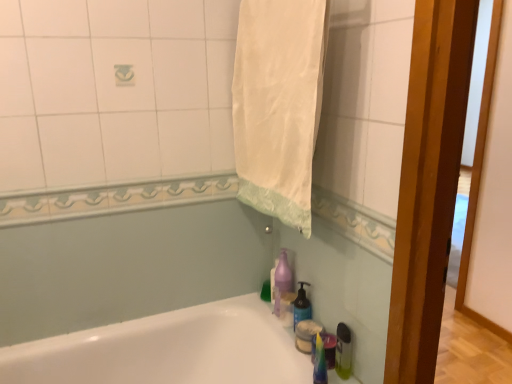
Question: Does white fabric towel at upper center have a lesser width compared to purple translucent soap dispenser at lower center?

Choices:
 (A) no
 (B) yes

Answer: (A)

Question: Is white fabric towel at upper center wider than purple translucent soap dispenser at lower center?

Choices:
 (A) yes
 (B) no

Answer: (A)

Question: Considering the relative sizes of white fabric towel at upper center and purple translucent soap dispenser at lower center in the image provided, is white fabric towel at upper center bigger than purple translucent soap dispenser at lower center?

Choices:
 (A) yes
 (B) no

Answer: (A)

Question: From the image's perspective, is white fabric towel at upper center on purple translucent soap dispenser at lower center?

Choices:
 (A) yes
 (B) no

Answer: (A)

Question: Is white fabric towel at upper center behind purple translucent soap dispenser at lower center?

Choices:
 (A) yes
 (B) no

Answer: (B)

Question: Relative to translucent plastic soap dispenser at lower right, is white fabric towel at upper center in front or behind?

Choices:
 (A) front
 (B) behind

Answer: (A)

Question: Looking at their shapes, would you say white fabric towel at upper center is wider or thinner than translucent plastic soap dispenser at lower right?

Choices:
 (A) wide
 (B) thin

Answer: (A)

Question: From a real-world perspective, is white fabric towel at upper center above or below translucent plastic soap dispenser at lower right?

Choices:
 (A) below
 (B) above

Answer: (B)

Question: In terms of height, does white fabric towel at upper center look taller or shorter compared to translucent plastic soap dispenser at lower right?

Choices:
 (A) tall
 (B) short

Answer: (A)

Question: Is point (279, 276) positioned closer to the camera than point (287, 129)?

Choices:
 (A) farther
 (B) closer

Answer: (A)

Question: Is purple translucent soap dispenser at lower center taller or shorter than white fabric towel at upper center?

Choices:
 (A) tall
 (B) short

Answer: (B)

Question: Is purple translucent soap dispenser at lower center in front of or behind white fabric towel at upper center in the image?

Choices:
 (A) front
 (B) behind

Answer: (B)

Question: In terms of size, does purple translucent soap dispenser at lower center appear bigger or smaller than white fabric towel at upper center?

Choices:
 (A) big
 (B) small

Answer: (B)

Question: Relative to white glossy bathtub at lower left, is purple translucent soap dispenser at lower center in front or behind?

Choices:
 (A) behind
 (B) front

Answer: (A)

Question: From the image's perspective, relative to white glossy bathtub at lower left, is purple translucent soap dispenser at lower center above or below?

Choices:
 (A) below
 (B) above

Answer: (B)